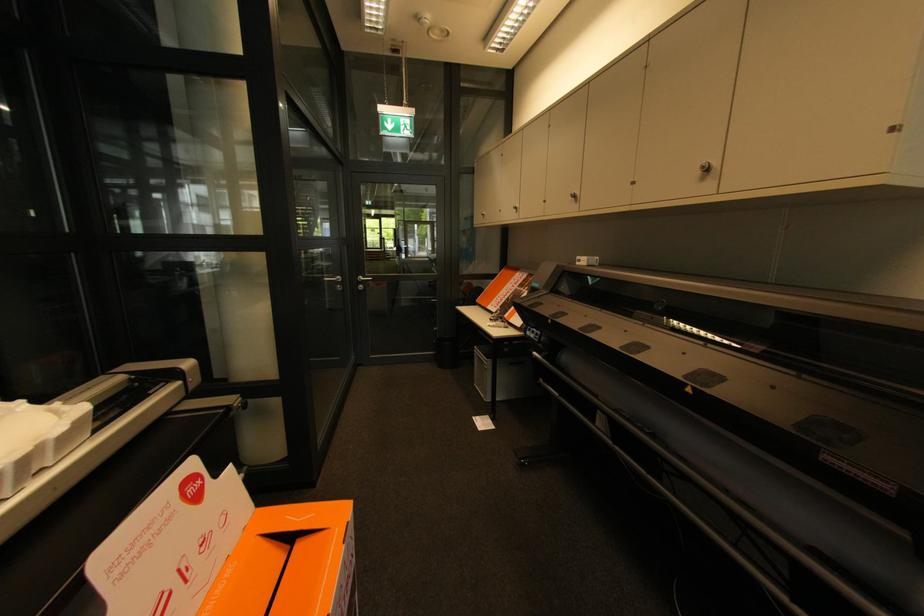
The height and width of the screenshot is (616, 924). I want to click on silver door handle, so click(x=369, y=281).